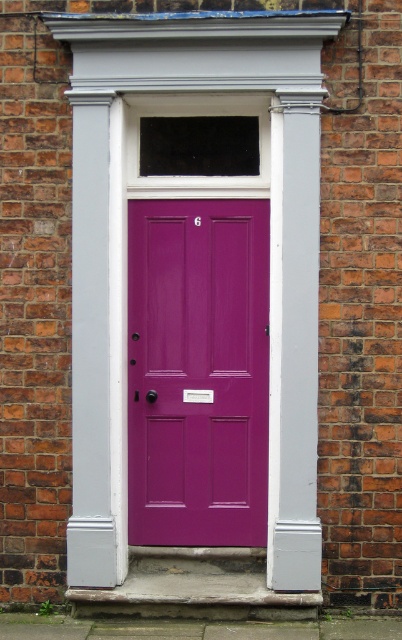
Is matte gray column at center smaller than glossy purple door at center?

Actually, matte gray column at center might be larger than glossy purple door at center.

Which is more to the right, matte gray column at center or glossy purple door at center?

Positioned to the right is matte gray column at center.

Is point (194, 67) positioned in front of point (149, 448)?

That is True.

The width and height of the screenshot is (402, 640). In order to click on matte gray column at center in this screenshot , I will do `click(127, 260)`.